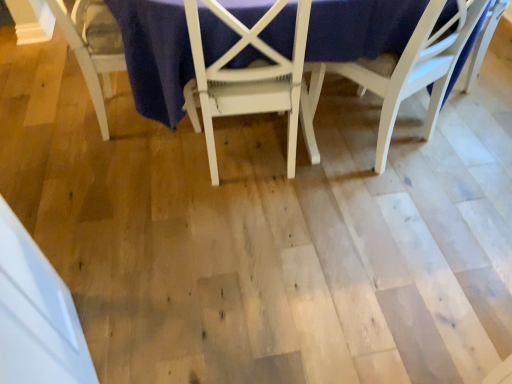
At what (x,y) coordinates should I click in order to perform the action: click on white painted wood chair at center, which ranks as the second chair in right-to-left order. Please return your answer as a coordinate pair (x, y). This screenshot has height=384, width=512. Looking at the image, I should click on (246, 77).

The height and width of the screenshot is (384, 512). What do you see at coordinates (156, 55) in the screenshot?
I see `white painted wood table at center` at bounding box center [156, 55].

Measure the distance between white painted wood table at center and camera.

white painted wood table at center and camera are 4.09 feet apart from each other.

Image resolution: width=512 pixels, height=384 pixels. Identify the location of white painted wood chair at center, the 2th chair when ordered from left to right. (246, 77).

From the image's perspective, which is below, white painted wood table at center or white painted wood chair at center, the 2th chair when ordered from left to right?

white painted wood chair at center, the 2th chair when ordered from left to right, is shown below in the image.

Could you measure the distance between white painted wood table at center and white painted wood chair at center, the 2th chair when ordered from left to right?

white painted wood table at center is 5.23 inches from white painted wood chair at center, the 2th chair when ordered from left to right.

This screenshot has height=384, width=512. I want to click on the 1st chair below the white painted wood table at center (from a real-world perspective), so click(246, 77).

Considering the relative sizes of white painted wood table at center and white painted wood chair at center, which ranks as the second chair in right-to-left order, in the image provided, is white painted wood table at center shorter than white painted wood chair at center, which ranks as the second chair in right-to-left order,?

No, white painted wood table at center is not shorter than white painted wood chair at center, which ranks as the second chair in right-to-left order.

Based on the photo, are white wood chair at lower left, which is counted as the first chair, starting from the left, and white painted wood table at center far apart?

That's not correct — white wood chair at lower left, which is counted as the first chair, starting from the left, is a little close to white painted wood table at center.

Is white wood chair at lower left, which is the 3th chair in right-to-left order, inside or outside of white painted wood table at center?

white wood chair at lower left, which is the 3th chair in right-to-left order, is inside white painted wood table at center.

How many degrees apart are the facing directions of white wood chair at lower left, which is the 3th chair in right-to-left order, and white painted wood table at center?

175 degrees separate the facing orientations of white wood chair at lower left, which is the 3th chair in right-to-left order, and white painted wood table at center.

From a real-world perspective, which is physically below, white wood chair at lower left, which is counted as the first chair, starting from the left, or white painted wood table at center?

white wood chair at lower left, which is counted as the first chair, starting from the left.

Considering the sizes of white painted wood chair at center, the 2th chair when ordered from left to right, and white wood chair at lower left, which is the 3th chair in right-to-left order, in the image, is white painted wood chair at center, the 2th chair when ordered from left to right, wider or thinner than white wood chair at lower left, which is the 3th chair in right-to-left order,?

Considering their sizes, white painted wood chair at center, the 2th chair when ordered from left to right, looks slimmer than white wood chair at lower left, which is the 3th chair in right-to-left order.

How distant is white painted wood chair at center, which ranks as the second chair in right-to-left order, from white wood chair at lower left, which is counted as the first chair, starting from the left?

A distance of 21.66 inches exists between white painted wood chair at center, which ranks as the second chair in right-to-left order, and white wood chair at lower left, which is counted as the first chair, starting from the left.

Looking at this image, what's the angular difference between white painted wood chair at center, which ranks as the second chair in right-to-left order, and white wood chair at lower left, which is the 3th chair in right-to-left order,'s facing directions?

86.6 degrees.

From a real-world perspective, is white painted wood chair at center, which ranks as the second chair in right-to-left order, on top of white wood chair at lower left, which is counted as the first chair, starting from the left?

Indeed, from a real-world perspective, white painted wood chair at center, which ranks as the second chair in right-to-left order, stands above white wood chair at lower left, which is counted as the first chair, starting from the left.

Is white painted wood table at center further to the viewer compared to white wood chair at upper right, the 3th chair positioned from the left?

No, it is not.

Who is taller, white painted wood table at center or white wood chair at upper right, the 3th chair positioned from the left?

Standing taller between the two is white painted wood table at center.

Does white painted wood table at center turn towards white wood chair at upper right, which is the first chair in right-to-left order?

No.

From the white wood chair at lower left, which is the 3th chair in right-to-left order, count 2nd chair to the right and point to it. Please provide its 2D coordinates.

[(399, 75)]

Considering the points (90, 64) and (441, 9), which point is behind, point (90, 64) or point (441, 9)?

The point (90, 64) is behind.

Is white painted wood table at center at the back of white painted wood chair at center, the 2th chair when ordered from left to right?

That's right, white painted wood chair at center, the 2th chair when ordered from left to right, is facing away from white painted wood table at center.

Considering the relative sizes of white painted wood chair at center, the 2th chair when ordered from left to right, and white painted wood table at center in the image provided, is white painted wood chair at center, the 2th chair when ordered from left to right, thinner than white painted wood table at center?

Indeed, white painted wood chair at center, the 2th chair when ordered from left to right, has a lesser width compared to white painted wood table at center.

Does white painted wood chair at center, which ranks as the second chair in right-to-left order, have a larger size compared to white painted wood table at center?

No.

From a real-world perspective, is white painted wood chair at center, the 2th chair when ordered from left to right, on white painted wood table at center?

No, from a real-world perspective, white painted wood chair at center, the 2th chair when ordered from left to right, is not on top of white painted wood table at center.

From a real-world perspective, is white wood chair at upper right, which is the first chair in right-to-left order, positioned above or below white painted wood chair at center, which ranks as the second chair in right-to-left order?

white wood chair at upper right, which is the first chair in right-to-left order, is below white painted wood chair at center, which ranks as the second chair in right-to-left order.

Based on the photo, is white wood chair at upper right, the 3th chair positioned from the left, aimed at white painted wood chair at center, which ranks as the second chair in right-to-left order?

No, white wood chair at upper right, the 3th chair positioned from the left, is not oriented towards white painted wood chair at center, which ranks as the second chair in right-to-left order.

This screenshot has width=512, height=384. I want to click on table in front of the white painted wood chair at center, the 2th chair when ordered from left to right, so click(156, 55).

The height and width of the screenshot is (384, 512). I want to click on the 2nd chair counting from the left of the white painted wood table at center, so click(x=93, y=47).

When comparing their distances from white wood chair at lower left, which is counted as the first chair, starting from the left, does white wood chair at upper right, which is the first chair in right-to-left order, or white painted wood table at center seem closer?

white painted wood table at center is positioned closer to the anchor white wood chair at lower left, which is counted as the first chair, starting from the left.

Considering their positions, is white wood chair at lower left, which is counted as the first chair, starting from the left, positioned closer to white wood chair at upper right, the 3th chair positioned from the left, than white painted wood table at center?

white painted wood table at center lies closer to white wood chair at upper right, the 3th chair positioned from the left, than the other object.

From the image, which object appears to be farther from white painted wood table at center, white wood chair at lower left, which is the 3th chair in right-to-left order, or white wood chair at upper right, which is the first chair in right-to-left order?

The object further to white painted wood table at center is white wood chair at lower left, which is the 3th chair in right-to-left order.

Considering their positions, is white wood chair at upper right, the 3th chair positioned from the left, positioned further to white painted wood chair at center, which ranks as the second chair in right-to-left order, than white painted wood table at center?

white wood chair at upper right, the 3th chair positioned from the left, is further to white painted wood chair at center, which ranks as the second chair in right-to-left order.

From the image, which object appears to be farther from white painted wood chair at center, the 2th chair when ordered from left to right, white wood chair at lower left, which is counted as the first chair, starting from the left, or white wood chair at upper right, the 3th chair positioned from the left?

white wood chair at lower left, which is counted as the first chair, starting from the left, is positioned further to the anchor white painted wood chair at center, the 2th chair when ordered from left to right.

From the picture: Looking at the image, which one is located closer to white painted wood chair at center, the 2th chair when ordered from left to right, white wood chair at upper right, which is the first chair in right-to-left order, or white wood chair at lower left, which is the 3th chair in right-to-left order?

Among the two, white wood chair at upper right, which is the first chair in right-to-left order, is located nearer to white painted wood chair at center, the 2th chair when ordered from left to right.

Considering their positions, is white wood chair at upper right, the 3th chair positioned from the left, positioned closer to white painted wood table at center than white wood chair at lower left, which is counted as the first chair, starting from the left?

Based on the image, white wood chair at upper right, the 3th chair positioned from the left, appears to be nearer to white painted wood table at center.

Which object lies nearer to the anchor point white painted wood table at center, white painted wood chair at center, the 2th chair when ordered from left to right, or white wood chair at lower left, which is counted as the first chair, starting from the left?

white painted wood chair at center, the 2th chair when ordered from left to right, is closer to white painted wood table at center.

The height and width of the screenshot is (384, 512). Identify the location of chair between white wood chair at lower left, which is counted as the first chair, starting from the left, and white wood chair at upper right, the 3th chair positioned from the left, from left to right. (246, 77).

Identify the location of table located between white wood chair at lower left, which is the 3th chair in right-to-left order, and white wood chair at upper right, which is the first chair in right-to-left order, in the left-right direction. Image resolution: width=512 pixels, height=384 pixels. tap(156, 55).

At what (x,y) coordinates should I click in order to perform the action: click on table between white painted wood chair at center, the 2th chair when ordered from left to right, and white wood chair at upper right, the 3th chair positioned from the left. Please return your answer as a coordinate pair (x, y). The width and height of the screenshot is (512, 384). Looking at the image, I should click on (156, 55).

Where is `chair between white wood chair at lower left, which is the 3th chair in right-to-left order, and white painted wood table at center`? The height and width of the screenshot is (384, 512). chair between white wood chair at lower left, which is the 3th chair in right-to-left order, and white painted wood table at center is located at coordinates (246, 77).